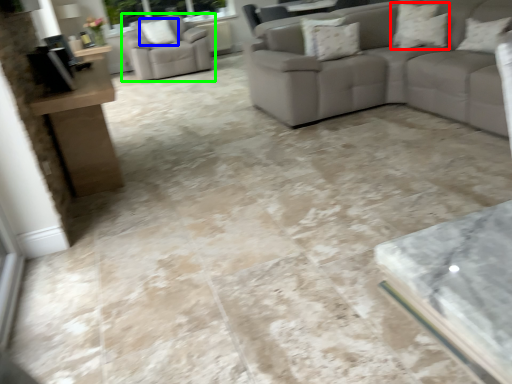
Question: Considering the real-world distances, which object is farthest from pillow (highlighted by a red box)? pillow (highlighted by a blue box) or chair (highlighted by a green box)?

Choices:
 (A) pillow
 (B) chair

Answer: (A)